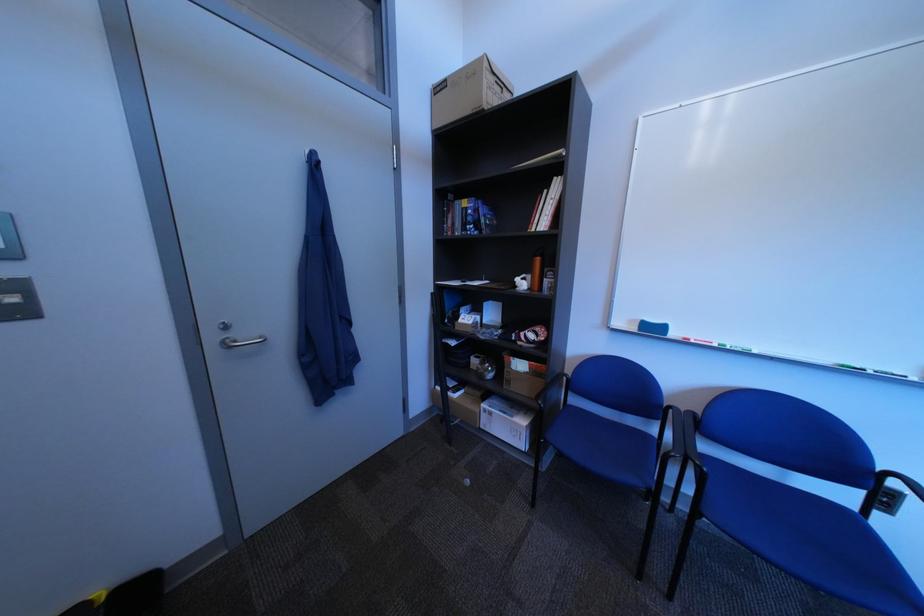
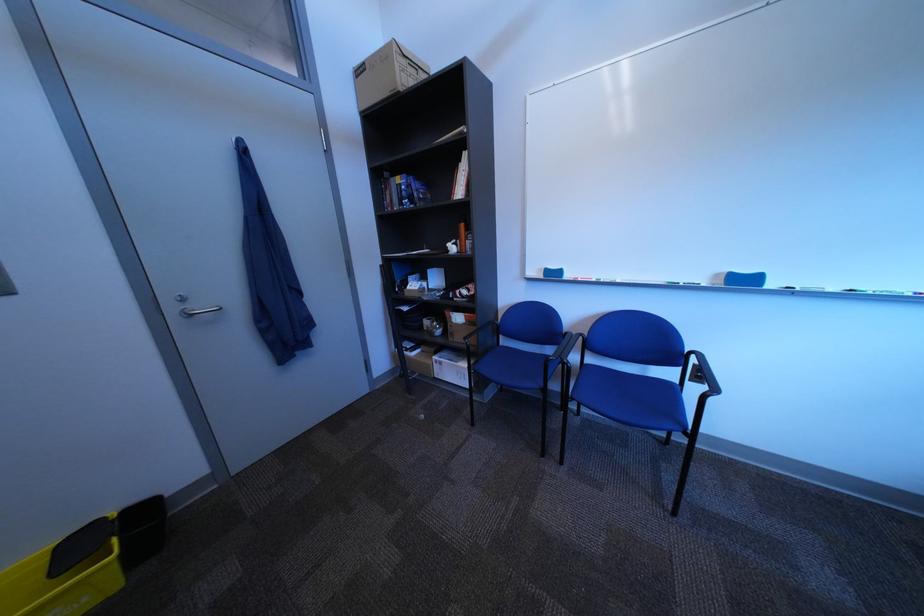
Question: How did the camera likely rotate?

Choices:
 (A) Left
 (B) Right
 (C) Up
 (D) Down

Answer: (D)